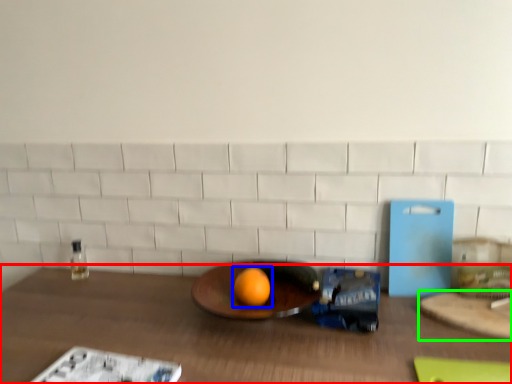
Question: Based on their relative distances, which object is farther from table (highlighted by a red box)? Choose from grapefruit (highlighted by a blue box) and cutting board (highlighted by a green box).

Choices:
 (A) grapefruit
 (B) cutting board

Answer: (B)